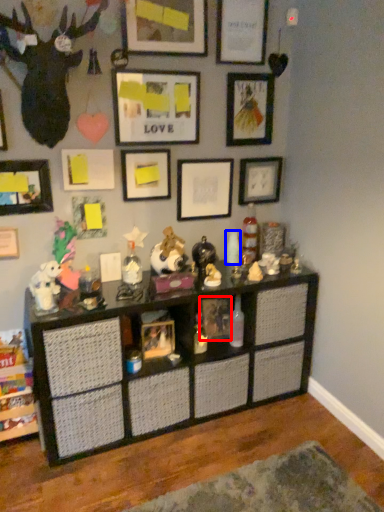
Question: Which object appears farthest to the camera in this image, picture frame (highlighted by a red box) or toy (highlighted by a blue box)?

Choices:
 (A) picture frame
 (B) toy

Answer: (B)